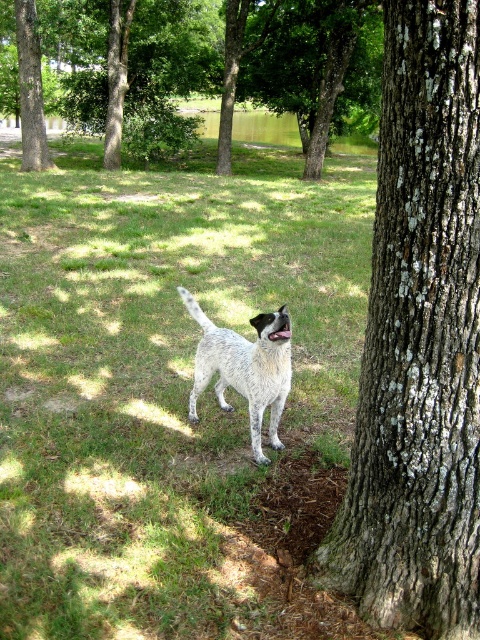
Can you confirm if grayish-brown bark tree trunk at right is bigger than green bark tree at upper center?

Actually, grayish-brown bark tree trunk at right might be smaller than green bark tree at upper center.

Does grayish-brown bark tree trunk at right come in front of green bark tree at upper center?

Yes, it is in front of green bark tree at upper center.

Between point (451, 474) and point (10, 1), which one is positioned in front?

Positioned in front is point (451, 474).

At what (x,y) coordinates should I click in order to perform the action: click on grayish-brown bark tree trunk at right. Please return your answer as a coordinate pair (x, y). Looking at the image, I should click on (420, 340).

From the picture: Does green grass at center have a greater width compared to grayish-brown bark tree trunk at right?

Yes.

Can you confirm if green grass at center is positioned below grayish-brown bark tree trunk at right?

No, green grass at center is not below grayish-brown bark tree trunk at right.

Is point (116, 428) farther from camera compared to point (336, 518)?

That is True.

Where is `green grass at center`? The height and width of the screenshot is (640, 480). green grass at center is located at coordinates (165, 394).

Is point (265, 96) more distant than point (23, 106)?

Yes.

I want to click on green bark tree at upper center, so 252,68.